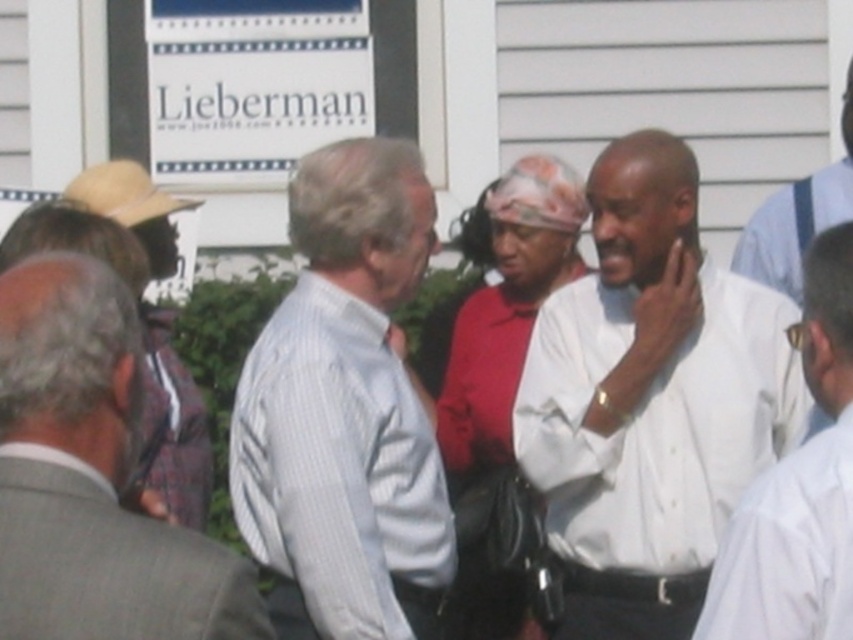
Which is behind, point (224, 596) or point (825, 257)?

Positioned behind is point (825, 257).

Does gray suit at left appear over white shirt at center?

Incorrect, gray suit at left is not positioned above white shirt at center.

The height and width of the screenshot is (640, 853). What do you see at coordinates (111, 566) in the screenshot?
I see `gray suit at left` at bounding box center [111, 566].

Locate an element on the screen. This screenshot has width=853, height=640. gray suit at left is located at coordinates (111, 566).

Who is taller, white cotton shirt at center or white shirt at right?

white cotton shirt at center

How distant is white cotton shirt at center from white shirt at right?

white cotton shirt at center is 20.69 feet away from white shirt at right.

Which is behind, point (448, 474) or point (842, 138)?

The point (842, 138) is behind.

Locate an element on the screen. The height and width of the screenshot is (640, 853). white cotton shirt at center is located at coordinates (503, 401).

Is white button-down shirt at center to the left of gray suit at left from the viewer's perspective?

In fact, white button-down shirt at center is to the right of gray suit at left.

Is white button-down shirt at center closer to camera compared to gray suit at left?

No, it is not.

Who is more forward, (657, 541) or (149, 616)?

Point (149, 616) is more forward.

Find the location of a particular element. The image size is (853, 640). white button-down shirt at center is located at coordinates pyautogui.click(x=650, y=400).